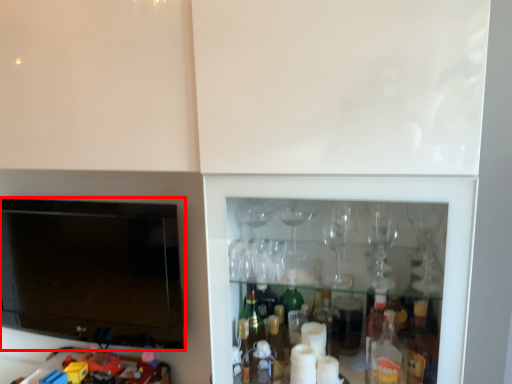
Question: From the image's perspective, what is the correct spatial positioning of television (annotated by the red box) in reference to toy?

Choices:
 (A) below
 (B) above

Answer: (B)